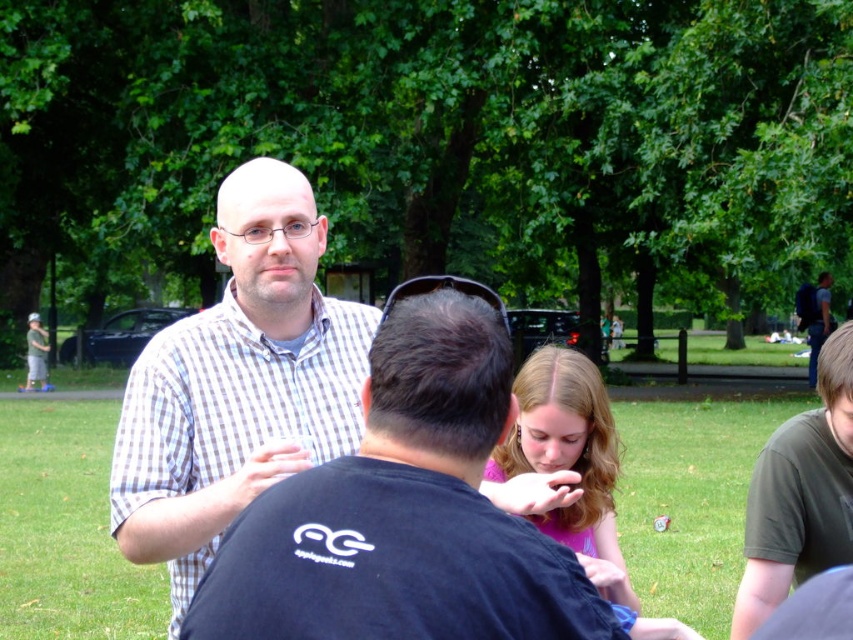
Question: Does green grass at center appear over dark green t-shirt at lower right?

Choices:
 (A) no
 (B) yes

Answer: (A)

Question: Does white checkered shirt at center lie in front of matte pink shirt at center?

Choices:
 (A) yes
 (B) no

Answer: (B)

Question: Does white checkered shirt at center have a greater width compared to dark green t-shirt at lower right?

Choices:
 (A) yes
 (B) no

Answer: (B)

Question: Which point is closer to the camera taking this photo?

Choices:
 (A) (550, 349)
 (B) (838, 358)
 (C) (16, 589)

Answer: (B)

Question: Which object appears farthest from the camera in this image?

Choices:
 (A) checkered fabric shirt at center
 (B) green grass at center

Answer: (B)

Question: Among these points, which one is farthest from the camera?

Choices:
 (A) (676, 572)
 (B) (514, 566)
 (C) (842, 472)
 (D) (260, 454)

Answer: (A)